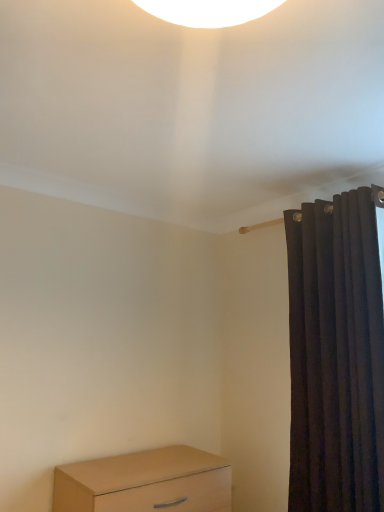
Question: Should I look upward or downward to see light brown wood chest of drawers at lower left?

Choices:
 (A) down
 (B) up

Answer: (A)

Question: Should I look upward or downward to see dark velvet curtain at right?

Choices:
 (A) up
 (B) down

Answer: (B)

Question: Does dark velvet curtain at right come behind light brown wood chest of drawers at lower left?

Choices:
 (A) yes
 (B) no

Answer: (B)

Question: From the image's perspective, is dark velvet curtain at right on top of light brown wood chest of drawers at lower left?

Choices:
 (A) yes
 (B) no

Answer: (A)

Question: Can you confirm if dark velvet curtain at right is bigger than light brown wood chest of drawers at lower left?

Choices:
 (A) yes
 (B) no

Answer: (A)

Question: Is light brown wood chest of drawers at lower left located within dark velvet curtain at right?

Choices:
 (A) no
 (B) yes

Answer: (A)

Question: Is dark velvet curtain at right not close to light brown wood chest of drawers at lower left?

Choices:
 (A) no
 (B) yes

Answer: (A)

Question: Is dark velvet curtain at right oriented away from light brown wood chest of drawers at lower left?

Choices:
 (A) no
 (B) yes

Answer: (A)

Question: Is light brown wood chest of drawers at lower left smaller than dark velvet curtain at right?

Choices:
 (A) no
 (B) yes

Answer: (B)

Question: Does light brown wood chest of drawers at lower left contain dark velvet curtain at right?

Choices:
 (A) no
 (B) yes

Answer: (A)

Question: Is light brown wood chest of drawers at lower left taller than dark velvet curtain at right?

Choices:
 (A) yes
 (B) no

Answer: (B)

Question: Is dark velvet curtain at right at the back of light brown wood chest of drawers at lower left?

Choices:
 (A) yes
 (B) no

Answer: (B)

Question: From a real-world perspective, is light brown wood chest of drawers at lower left on dark velvet curtain at right?

Choices:
 (A) no
 (B) yes

Answer: (A)

Question: Considering the relative sizes of light brown wood chest of drawers at lower left and dark velvet curtain at right in the image provided, is light brown wood chest of drawers at lower left bigger than dark velvet curtain at right?

Choices:
 (A) yes
 (B) no

Answer: (B)

Question: Relative to dark velvet curtain at right, is light brown wood chest of drawers at lower left in front or behind?

Choices:
 (A) front
 (B) behind

Answer: (B)